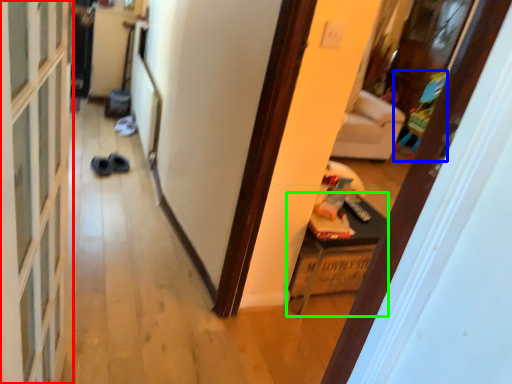
Question: Which object is positioned farthest from screen door (highlighted by a red box)? Select from toy (highlighted by a blue box) and furniture (highlighted by a green box).

Choices:
 (A) toy
 (B) furniture

Answer: (A)